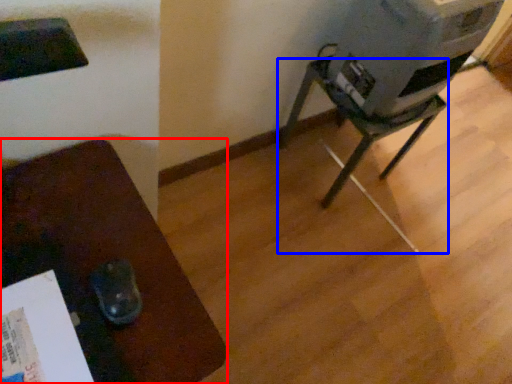
Question: Which object appears farthest to the camera in this image, furniture (highlighted by a red box) or furniture (highlighted by a blue box)?

Choices:
 (A) furniture
 (B) furniture

Answer: (B)